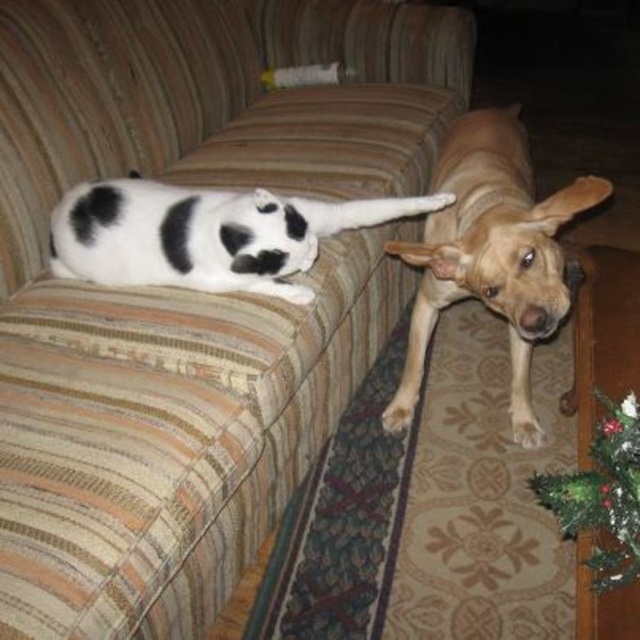
Is striped fabric couch at upper left positioned behind light brown fur at lower right?

No, striped fabric couch at upper left is in front of light brown fur at lower right.

Can you confirm if striped fabric couch at upper left is positioned below light brown fur at lower right?

No, striped fabric couch at upper left is not below light brown fur at lower right.

Who is more forward, (310, 310) or (397, 403)?

Point (310, 310) is more forward.

Where is `striped fabric couch at upper left`? striped fabric couch at upper left is located at coordinates (188, 291).

Can you confirm if white fur at lower right is smaller than light brown fur at lower right?

No.

Locate an element on the screen. The width and height of the screenshot is (640, 640). white fur at lower right is located at coordinates [525, 426].

You are a GUI agent. You are given a task and a screenshot of the screen. Output one action in this format:
    pyautogui.click(x=<x>, y=<y>)
    Task: Click on the white fur at lower right
    
    Given the screenshot: What is the action you would take?
    pyautogui.click(x=525, y=426)

Is striped fabric couch at upper left wider than white fur at lower right?

Yes.

Who is positioned more to the right, striped fabric couch at upper left or white fur at lower right?

Positioned to the right is white fur at lower right.

Is point (26, 156) closer to viewer compared to point (512, 426)?

Yes, point (26, 156) is closer to viewer.

At what (x,y) coordinates should I click in order to perform the action: click on striped fabric couch at upper left. Please return your answer as a coordinate pair (x, y). The width and height of the screenshot is (640, 640). Looking at the image, I should click on click(x=188, y=291).